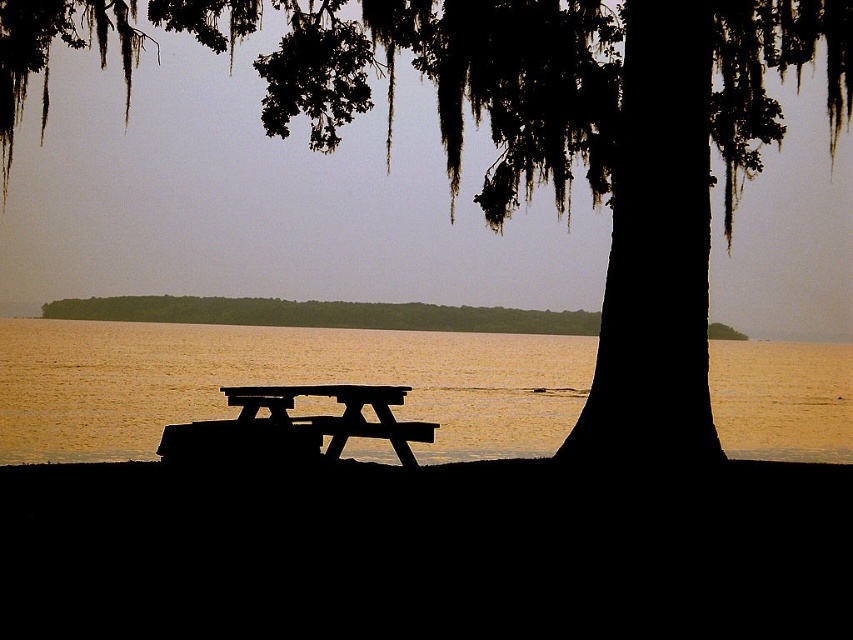
Between golden sand water at center and black wood bench at center, which one has less height?

With less height is black wood bench at center.

Consider the image. Does golden sand water at center have a larger size compared to black wood bench at center?

Yes.

Describe the element at coordinates (276, 384) in the screenshot. I see `golden sand water at center` at that location.

Where is `golden sand water at center`? The height and width of the screenshot is (640, 853). golden sand water at center is located at coordinates (276, 384).

Who is more forward, (641, 44) or (244, 403)?

Point (641, 44) is in front.

This screenshot has width=853, height=640. Find the location of `silhouette bark tree at center`. silhouette bark tree at center is located at coordinates tap(589, 150).

Does point (573, 64) come behind point (76, 355)?

No.

Can you confirm if silhouette bark tree at center is positioned above golden sand water at center?

Yes.

Which is behind, point (604, 77) or point (758, 451)?

Point (758, 451)

Locate an element on the screen. The width and height of the screenshot is (853, 640). silhouette bark tree at center is located at coordinates (589, 150).